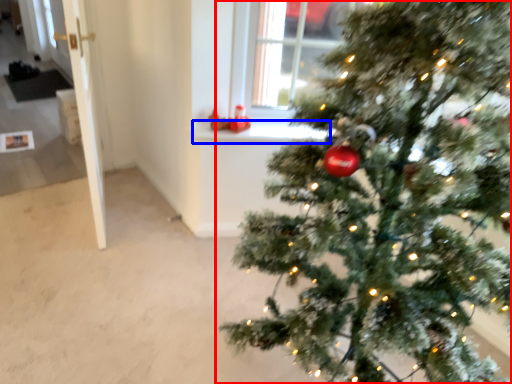
Question: Which point is further to the camera, christmas tree (highlighted by a red box) or window sill (highlighted by a blue box)?

Choices:
 (A) christmas tree
 (B) window sill

Answer: (B)